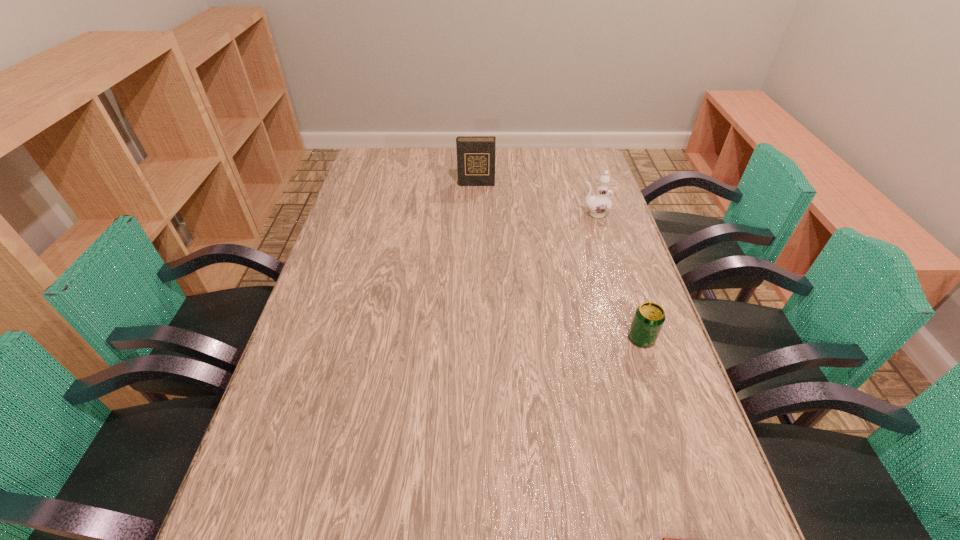
What are the coordinates of `chinaware that is at the right edge` in the screenshot? It's located at (599, 204).

This screenshot has width=960, height=540. I want to click on beer can present at the right edge, so click(x=649, y=317).

Locate an element on the screen. This screenshot has height=540, width=960. vacant space at the far edge of the desktop is located at coordinates (404, 171).

Locate an element on the screen. vacant space at the left edge of the desktop is located at coordinates (324, 396).

Where is `vacant space at the right edge of the desktop`? vacant space at the right edge of the desktop is located at coordinates (599, 265).

Find the location of a particular element. The height and width of the screenshot is (540, 960). vacant space at the far left corner of the desktop is located at coordinates (390, 148).

The image size is (960, 540). I want to click on blank region between the third nearest object and the second nearest object, so click(x=618, y=276).

What are the coordinates of `free area in between the farthest object and the chinaware` in the screenshot? It's located at (535, 199).

Image resolution: width=960 pixels, height=540 pixels. What are the coordinates of `empty space that is in between the taller diary and the beer can` in the screenshot? It's located at (559, 261).

This screenshot has width=960, height=540. Identify the location of free space between the farther diary and the third nearest object. (535, 199).